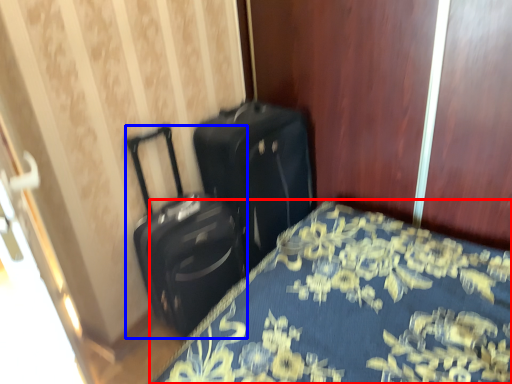
Question: Which point is closer to the camera, bed (highlighted by a red box) or suitcase (highlighted by a blue box)?

Choices:
 (A) bed
 (B) suitcase

Answer: (A)